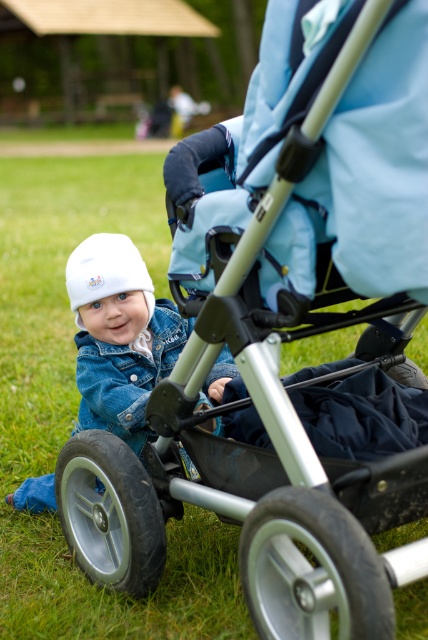
Question: Among these points, which one is nearest to the camera?

Choices:
 (A) (145, 294)
 (B) (91, 308)

Answer: (B)

Question: Which point is closer to the camera?

Choices:
 (A) (98, 340)
 (B) (145, 275)

Answer: (B)

Question: Which of the following is the closest to the observer?

Choices:
 (A) (94, 288)
 (B) (121, 337)

Answer: (A)

Question: Is white matte hat at lower left smaller than white fleece hat at center?

Choices:
 (A) yes
 (B) no

Answer: (B)

Question: Is white matte hat at lower left bigger than white fleece hat at center?

Choices:
 (A) yes
 (B) no

Answer: (A)

Question: Can you confirm if white matte hat at lower left is positioned above white fleece hat at center?

Choices:
 (A) no
 (B) yes

Answer: (A)